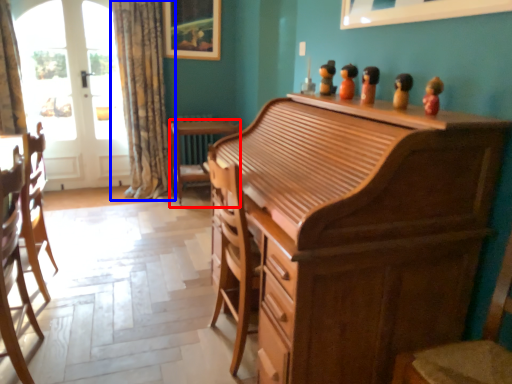
Question: Which object is closer to the camera taking this photo, desk (highlighted by a red box) or curtain (highlighted by a blue box)?

Choices:
 (A) desk
 (B) curtain

Answer: (B)